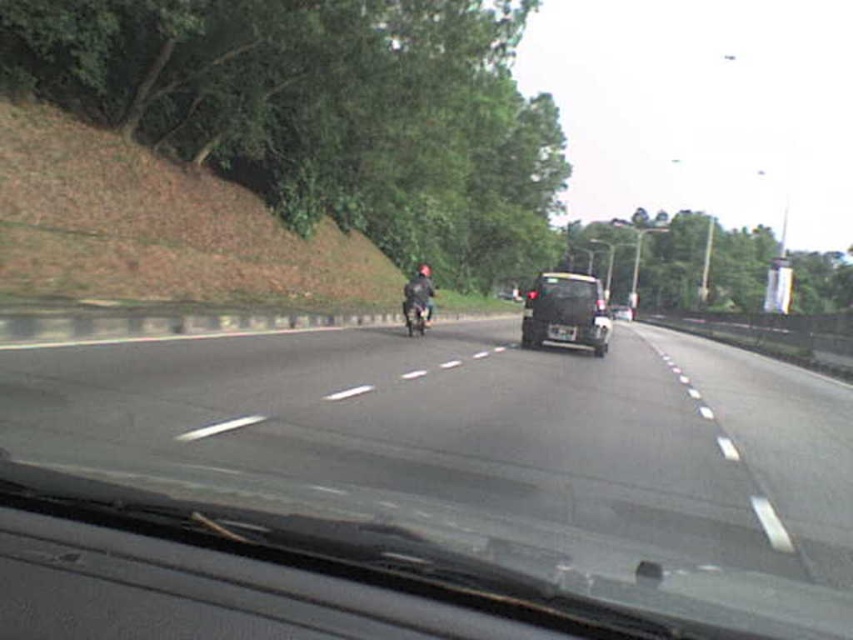
Is black asphalt road at center below shiny metallic motorcycle at center?

Indeed, black asphalt road at center is positioned under shiny metallic motorcycle at center.

Is black asphalt road at center positioned in front of shiny metallic motorcycle at center?

Yes, it is in front of shiny metallic motorcycle at center.

Where is `black asphalt road at center`? black asphalt road at center is located at coordinates (489, 452).

Between black matte van at center and shiny metallic motorcycle at center, which one has less height?

black matte van at center

Which is in front, point (531, 339) or point (405, 304)?

Point (405, 304) is in front.

The image size is (853, 640). I want to click on black matte van at center, so click(x=566, y=312).

Locate an element on the screen. Image resolution: width=853 pixels, height=640 pixels. dark gray matte jacket at center is located at coordinates (418, 300).

Who is shorter, dark gray matte jacket at center or shiny metallic motorcycle at center?

shiny metallic motorcycle at center

Is point (425, 308) farther from viewer compared to point (409, 324)?

Yes, it is.

At what (x,y) coordinates should I click in order to perform the action: click on dark gray matte jacket at center. Please return your answer as a coordinate pair (x, y). The height and width of the screenshot is (640, 853). Looking at the image, I should click on (418, 300).